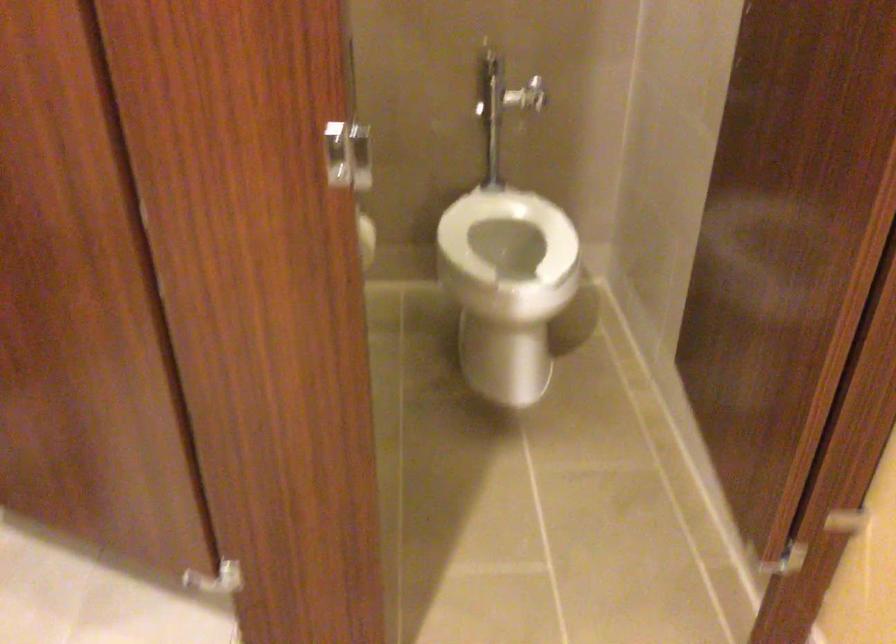
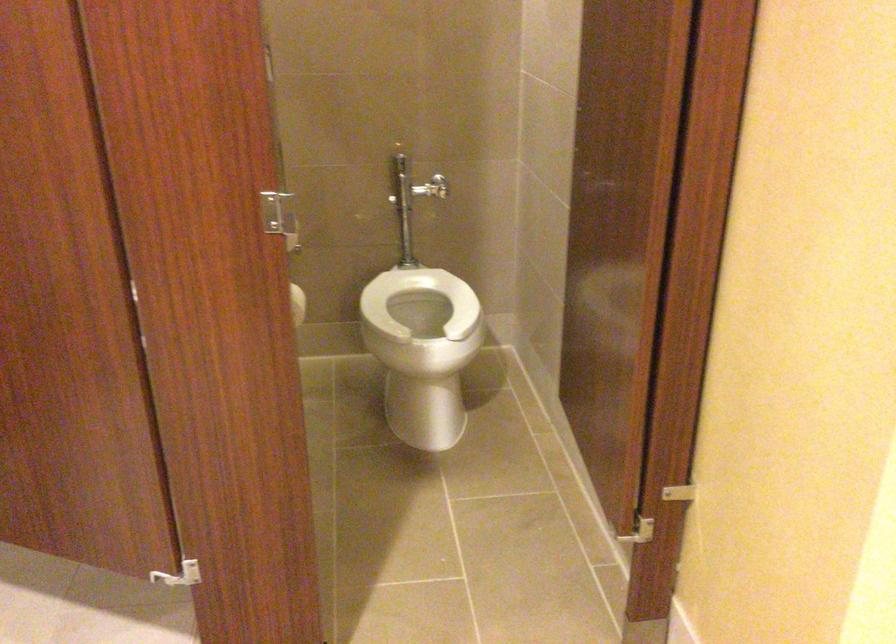
Locate, in the second image, the point that corresponds to point 350,158 in the first image.

(279, 216)